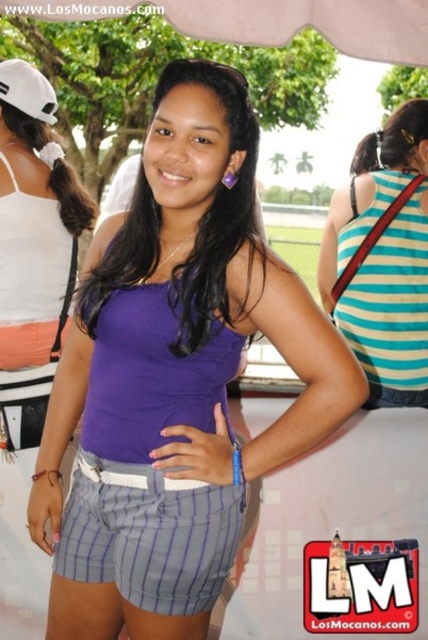
Is striped fabric tank top at center positioned at the back of white matte baseball cap at upper left?

Yes, it is.

Does striped fabric tank top at center have a smaller size compared to white matte baseball cap at upper left?

No.

At what (x,y) coordinates should I click in order to perform the action: click on striped fabric tank top at center. Please return your answer as a coordinate pair (x, y). The width and height of the screenshot is (428, 640). Looking at the image, I should click on (383, 259).

I want to click on striped fabric tank top at center, so click(383, 259).

Which is above, gray striped shorts at center or white matte baseball cap at upper left?

white matte baseball cap at upper left is higher up.

Is point (228, 497) positioned behind point (17, 61)?

No, it is in front of (17, 61).

Locate an element on the screen. This screenshot has width=428, height=640. gray striped shorts at center is located at coordinates (148, 534).

Does striped fabric tank top at center have a lesser height compared to purple matte tank top at center?

No.

Based on the photo, who is positioned more to the right, striped fabric tank top at center or purple matte tank top at center?

From the viewer's perspective, striped fabric tank top at center appears more on the right side.

Where is `striped fabric tank top at center`? The image size is (428, 640). striped fabric tank top at center is located at coordinates (383, 259).

You are a GUI agent. You are given a task and a screenshot of the screen. Output one action in this format:
    pyautogui.click(x=<x>, y=<y>)
    Task: Click on the striped fabric tank top at center
    The width and height of the screenshot is (428, 640).
    Given the screenshot: What is the action you would take?
    pyautogui.click(x=383, y=259)